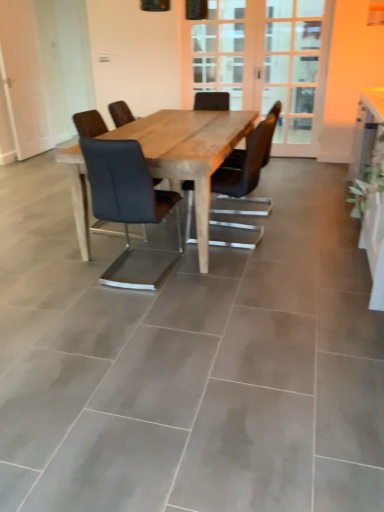
Question: Can you confirm if green leafy plant at upper right is thinner than natural wood table at center?

Choices:
 (A) no
 (B) yes

Answer: (B)

Question: Is natural wood table at center at the back of green leafy plant at upper right?

Choices:
 (A) no
 (B) yes

Answer: (A)

Question: Can you confirm if green leafy plant at upper right is positioned to the left of natural wood table at center?

Choices:
 (A) no
 (B) yes

Answer: (A)

Question: Is green leafy plant at upper right wider than natural wood table at center?

Choices:
 (A) no
 (B) yes

Answer: (A)

Question: From the image's perspective, does green leafy plant at upper right appear higher than natural wood table at center?

Choices:
 (A) no
 (B) yes

Answer: (B)

Question: Does green leafy plant at upper right have a smaller size compared to natural wood table at center?

Choices:
 (A) no
 (B) yes

Answer: (B)

Question: From the image's perspective, is wooden screen door at center, the second screen door positioned from the right, beneath white glossy computer desk at right?

Choices:
 (A) yes
 (B) no

Answer: (B)

Question: Is white glossy computer desk at right at the back of wooden screen door at center, the second screen door positioned from the right?

Choices:
 (A) no
 (B) yes

Answer: (A)

Question: Is white glossy computer desk at right inside wooden screen door at center, which ranks as the 1th screen door in left-to-right order?

Choices:
 (A) yes
 (B) no

Answer: (B)

Question: Can you confirm if wooden screen door at center, the second screen door positioned from the right, is thinner than white glossy computer desk at right?

Choices:
 (A) no
 (B) yes

Answer: (B)

Question: Can you confirm if wooden screen door at center, the second screen door positioned from the right, is positioned to the right of white glossy computer desk at right?

Choices:
 (A) no
 (B) yes

Answer: (A)

Question: Can we say wooden screen door at center, the second screen door positioned from the right, lies outside white glossy computer desk at right?

Choices:
 (A) yes
 (B) no

Answer: (A)

Question: Considering the relative sizes of matte black chair at center, the 1th chair positioned from the right, and wooden screen door at center, the second screen door positioned from the right, in the image provided, is matte black chair at center, the 1th chair positioned from the right, shorter than wooden screen door at center, the second screen door positioned from the right,?

Choices:
 (A) yes
 (B) no

Answer: (A)